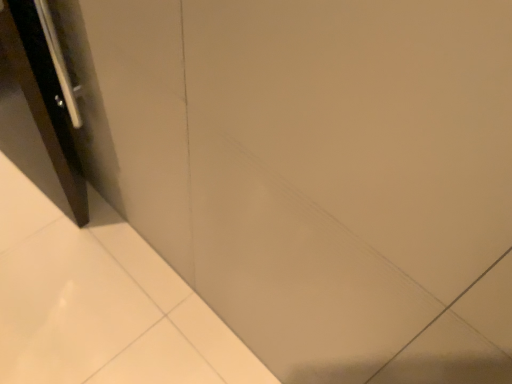
What do you see at coordinates (37, 111) in the screenshot? I see `black glossy door at left` at bounding box center [37, 111].

This screenshot has width=512, height=384. I want to click on black glossy door at left, so click(x=37, y=111).

Find the location of a particular element. This screenshot has width=512, height=384. black glossy door at left is located at coordinates (37, 111).